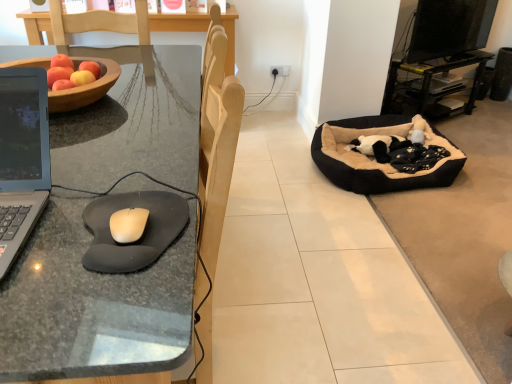
Locate an element on the screen. free space to the back side of black foam mousepad at left is located at coordinates (142, 170).